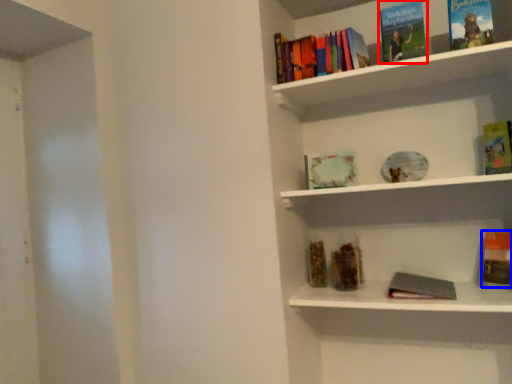
Question: Which object is further to the camera taking this photo, book (highlighted by a red box) or book (highlighted by a blue box)?

Choices:
 (A) book
 (B) book

Answer: (B)